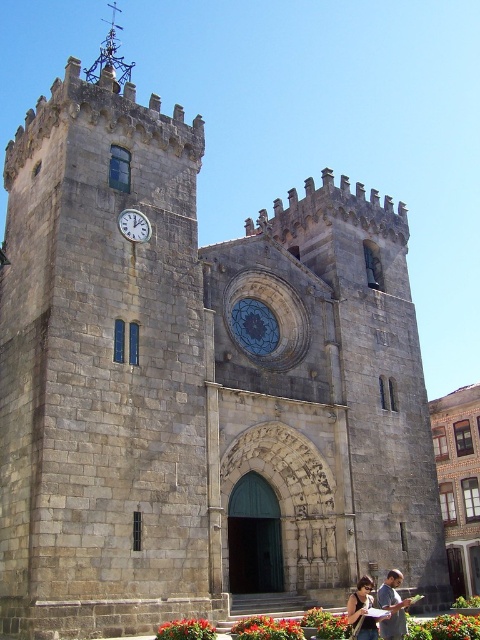
Question: From the image, what is the correct spatial relationship of matte gray stone couple at center in relation to silver metallic clock at upper left?

Choices:
 (A) left
 (B) right

Answer: (B)

Question: Which of the following is the farthest from the observer?

Choices:
 (A) silver metallic clock at upper left
 (B) matte gray stone couple at center

Answer: (A)

Question: Does matte gray stone couple at center have a larger size compared to silver metallic clock at upper left?

Choices:
 (A) yes
 (B) no

Answer: (A)

Question: Which point is farther from the camera taking this photo?

Choices:
 (A) (145, 225)
 (B) (391, 630)

Answer: (A)

Question: Is matte gray stone couple at center further to the viewer compared to silver metallic clock at upper left?

Choices:
 (A) no
 (B) yes

Answer: (A)

Question: Which point is farther to the camera?

Choices:
 (A) silver metallic clock at upper left
 (B) matte gray stone couple at center

Answer: (A)